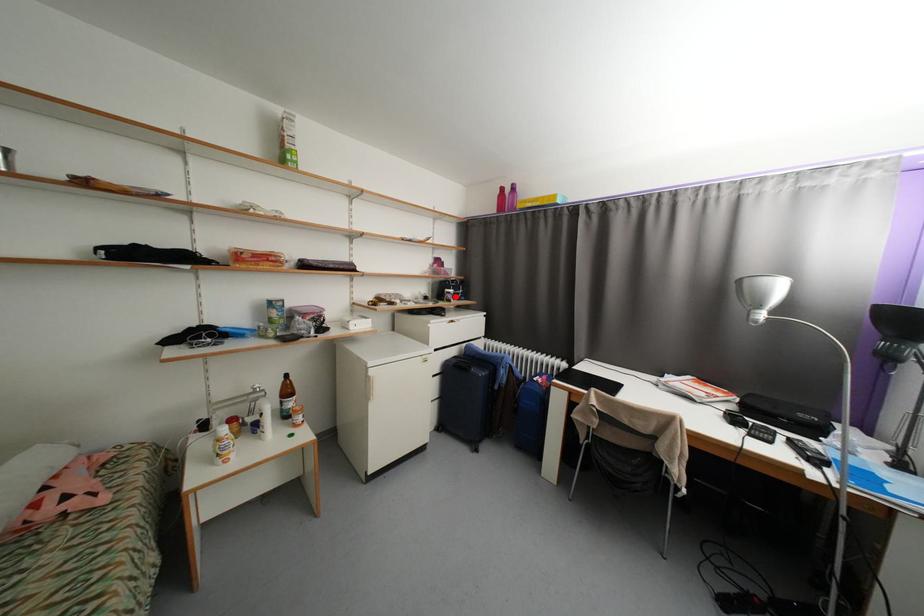
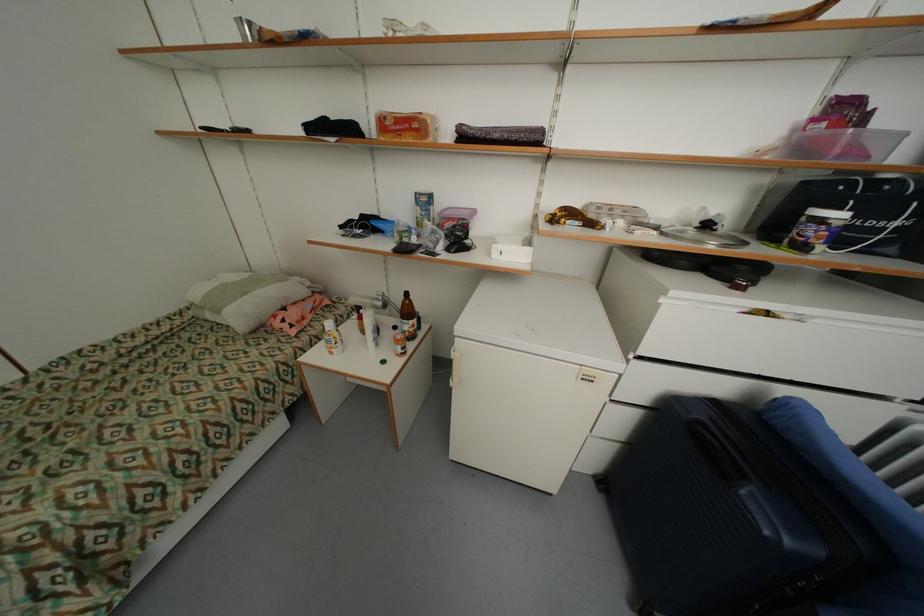
The point at the highlighted location is marked in the first image. Where is the corresponding point in the second image?

(819, 233)